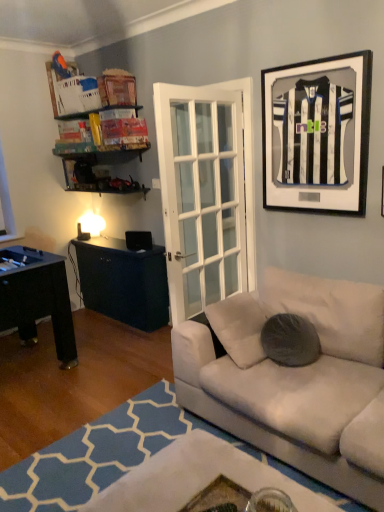
Question: Does white fabric couch at lower right contain black matte jersey at upper right?

Choices:
 (A) yes
 (B) no

Answer: (B)

Question: From the image's perspective, does white fabric couch at lower right appear higher than black matte jersey at upper right?

Choices:
 (A) no
 (B) yes

Answer: (A)

Question: Can you confirm if white fabric couch at lower right is shorter than black matte jersey at upper right?

Choices:
 (A) yes
 (B) no

Answer: (A)

Question: Considering the relative sizes of white fabric couch at lower right and black matte jersey at upper right in the image provided, is white fabric couch at lower right wider than black matte jersey at upper right?

Choices:
 (A) no
 (B) yes

Answer: (B)

Question: From the image's perspective, would you say white fabric couch at lower right is shown under black matte jersey at upper right?

Choices:
 (A) no
 (B) yes

Answer: (B)

Question: From a real-world perspective, is white fabric couch at lower right above or below black matte jersey at upper right?

Choices:
 (A) above
 (B) below

Answer: (B)

Question: Visually, is white fabric couch at lower right positioned to the left or to the right of black matte jersey at upper right?

Choices:
 (A) left
 (B) right

Answer: (A)

Question: Looking at the image, does white fabric couch at lower right seem bigger or smaller compared to black matte jersey at upper right?

Choices:
 (A) small
 (B) big

Answer: (B)

Question: Which is correct: white fabric couch at lower right is inside black matte jersey at upper right, or outside of it?

Choices:
 (A) outside
 (B) inside

Answer: (A)

Question: From the image's perspective, is black matte jersey at upper right located above or below gray fuzzy pillow at center?

Choices:
 (A) below
 (B) above

Answer: (B)

Question: Is black matte jersey at upper right wider or thinner than gray fuzzy pillow at center?

Choices:
 (A) wide
 (B) thin

Answer: (B)

Question: In terms of size, does black matte jersey at upper right appear bigger or smaller than gray fuzzy pillow at center?

Choices:
 (A) small
 (B) big

Answer: (B)

Question: Is black matte jersey at upper right spatially inside gray fuzzy pillow at center, or outside of it?

Choices:
 (A) outside
 (B) inside

Answer: (A)

Question: From a real-world perspective, relative to black matte jersey at upper right, is gray fuzzy pillow at center vertically above or below?

Choices:
 (A) above
 (B) below

Answer: (B)

Question: From the image's perspective, relative to black matte jersey at upper right, is gray fuzzy pillow at center above or below?

Choices:
 (A) above
 (B) below

Answer: (B)